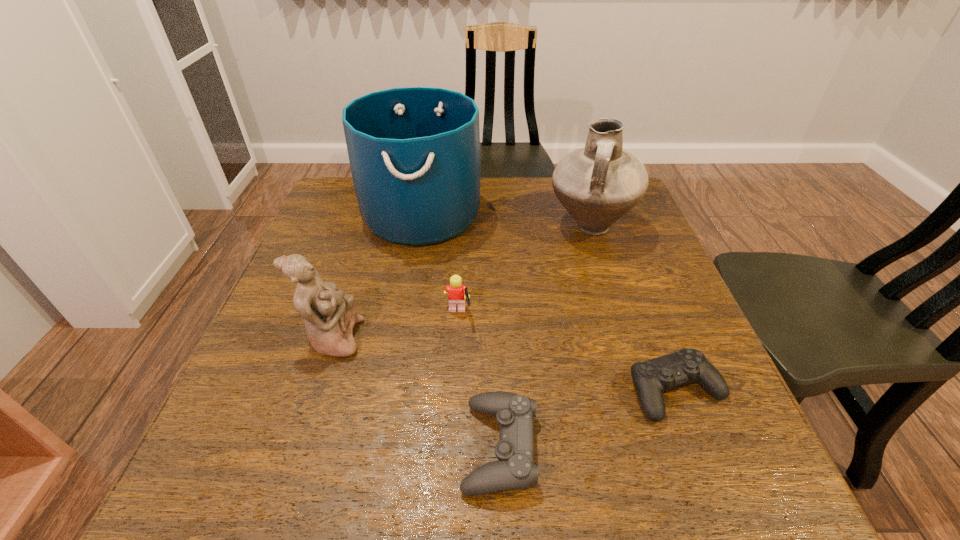
Locate an element on the screen. The image size is (960, 540). vacant space positioned on the left of the right control is located at coordinates (529, 391).

Identify the location of free space located 0.270m on the left of the left control. The height and width of the screenshot is (540, 960). pos(295,447).

Find the location of a particular element. bucket present at the far edge is located at coordinates (414, 152).

At what (x,y) coordinates should I click in order to perform the action: click on pitcher present at the far edge. Please return your answer as a coordinate pair (x, y). The height and width of the screenshot is (540, 960). Looking at the image, I should click on (598, 184).

You are a GUI agent. You are given a task and a screenshot of the screen. Output one action in this format:
    pyautogui.click(x=<x>, y=<y>)
    Task: Click on the object that is at the near edge
    
    Given the screenshot: What is the action you would take?
    pyautogui.click(x=515, y=470)

In order to click on bucket that is at the left edge in this screenshot , I will do `click(414, 152)`.

Image resolution: width=960 pixels, height=540 pixels. I want to click on figurine that is at the left edge, so click(x=330, y=316).

I want to click on pitcher that is positioned at the right edge, so click(598, 184).

The width and height of the screenshot is (960, 540). Find the location of `control located in the right edge section of the desktop`. control located in the right edge section of the desktop is located at coordinates (650, 378).

Image resolution: width=960 pixels, height=540 pixels. I want to click on object that is positioned at the far left corner, so click(414, 152).